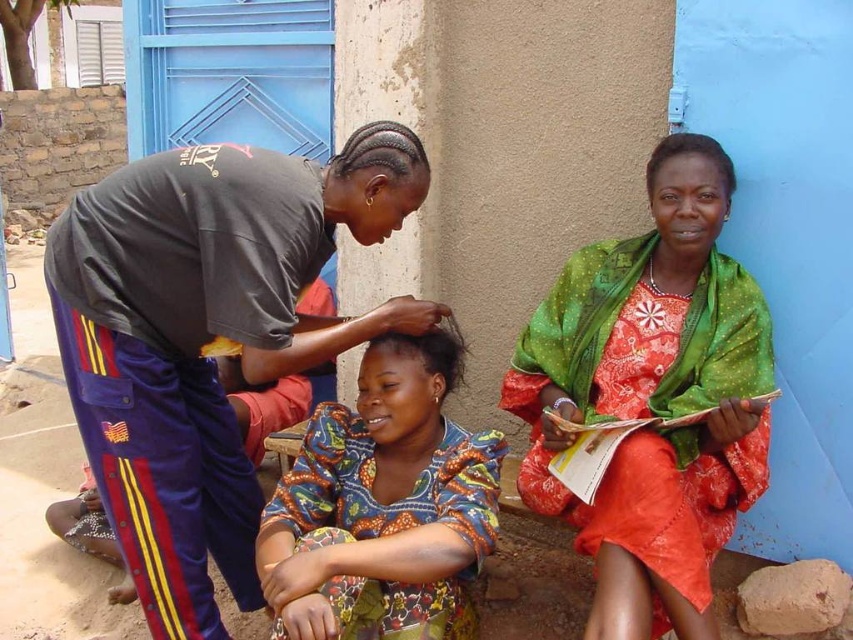
Question: Is green textured scarf at right to the left of printed fabric dress at center from the viewer's perspective?

Choices:
 (A) yes
 (B) no

Answer: (B)

Question: Can you confirm if matte gray shirt at left is positioned to the left of printed fabric dress at center?

Choices:
 (A) no
 (B) yes

Answer: (B)

Question: Which object is positioned closest to the green textured scarf at right?

Choices:
 (A) printed fabric dress at center
 (B) matte gray shirt at left

Answer: (A)

Question: Is matte gray shirt at left smaller than green textured scarf at right?

Choices:
 (A) no
 (B) yes

Answer: (A)

Question: Which of the following is the farthest from the observer?

Choices:
 (A) green textured scarf at right
 (B) printed fabric dress at center
 (C) matte gray shirt at left

Answer: (A)

Question: Which point is farther from the camera taking this photo?

Choices:
 (A) (434, 385)
 (B) (57, 221)

Answer: (A)